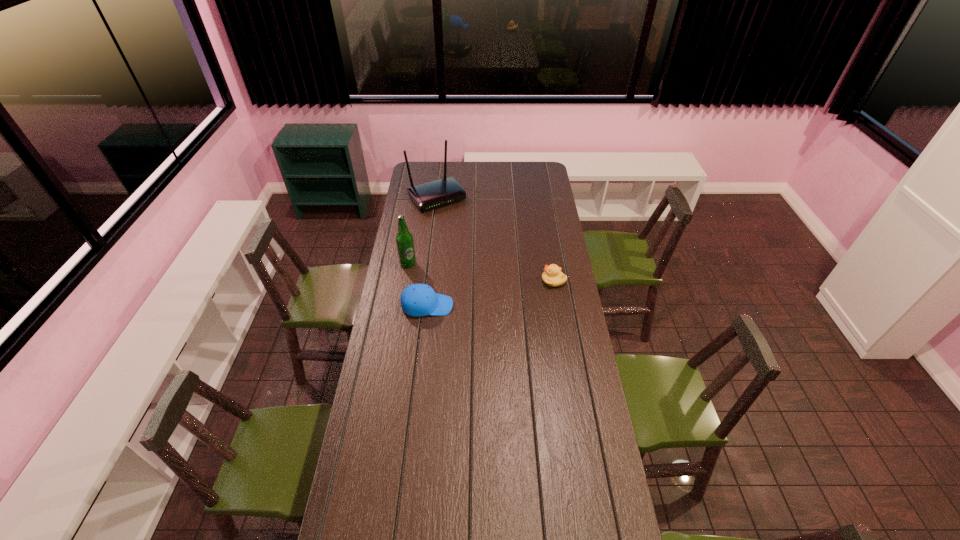
Locate an element on the screen. Image resolution: width=960 pixels, height=540 pixels. cap is located at coordinates (418, 299).

The image size is (960, 540). What are the coordinates of `the rightmost object` in the screenshot? It's located at (552, 276).

This screenshot has width=960, height=540. Identify the location of the second nearest object. (552, 276).

At what (x,y) coordinates should I click in order to perform the action: click on beer bottle. Please return your answer as a coordinate pair (x, y). The width and height of the screenshot is (960, 540). Looking at the image, I should click on (404, 240).

This screenshot has width=960, height=540. Identify the location of the farthest object. (434, 194).

You are a GUI agent. You are given a task and a screenshot of the screen. Output one action in this format:
    pyautogui.click(x=<x>, y=<y>)
    Task: Click on the vacant space situated 0.290m on the front-facing side of the nearest object
    The image size is (960, 540).
    Given the screenshot: What is the action you would take?
    pyautogui.click(x=516, y=306)

You are a GUI agent. You are given a task and a screenshot of the screen. Output one action in this format:
    pyautogui.click(x=<x>, y=<y>)
    Task: Click on the vacant space located 0.180m on the beak of the rightmost object
    This screenshot has width=960, height=540.
    Given the screenshot: What is the action you would take?
    pyautogui.click(x=505, y=281)

At what (x,y) coordinates should I click in order to perform the action: click on free space located 0.220m on the beak of the rightmost object. Please return your answer as a coordinate pair (x, y). The height and width of the screenshot is (540, 960). Looking at the image, I should click on (497, 281).

Find the location of a particular element. The width and height of the screenshot is (960, 540). vacant region located 0.110m on the beak of the rightmost object is located at coordinates (519, 281).

I want to click on free region located on the label of the beer bottle, so click(444, 273).